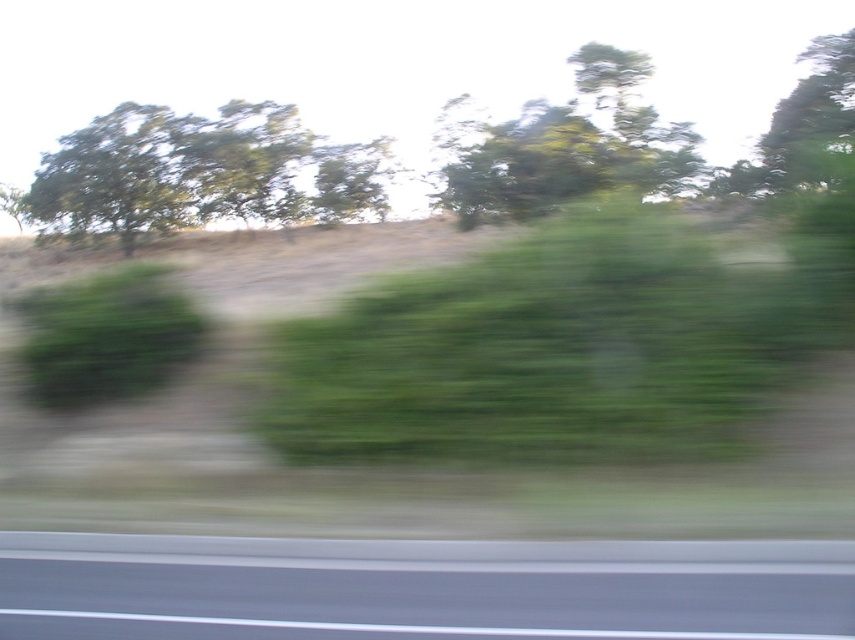
Can you confirm if green leafy hedge at center is shorter than green leafy tree at upper left?

Indeed, green leafy hedge at center has a lesser height compared to green leafy tree at upper left.

This screenshot has height=640, width=855. What are the coordinates of `green leafy hedge at center` in the screenshot? It's located at (558, 349).

Where is `green leafy hedge at center`? This screenshot has height=640, width=855. green leafy hedge at center is located at coordinates (558, 349).

Describe the element at coordinates (422, 588) in the screenshot. This screenshot has width=855, height=640. I see `smooth asphalt highway at lower center` at that location.

Is point (546, 600) positioned in front of point (133, 282)?

That is True.

Measure the distance between point [637,550] and camera.

Point [637,550] and camera are 6.89 meters apart from each other.

Identify the location of smooth asphalt highway at lower center. (422, 588).

Does green leafy hedge at center have a greater height compared to green leafy bush at left?

Indeed, green leafy hedge at center has a greater height compared to green leafy bush at left.

Is point (653, 339) farther from camera compared to point (187, 326)?

No, it is not.

Where is `green leafy hedge at center`? Image resolution: width=855 pixels, height=640 pixels. green leafy hedge at center is located at coordinates pos(558,349).

The image size is (855, 640). Find the location of `green leafy hedge at center`. green leafy hedge at center is located at coordinates (558, 349).